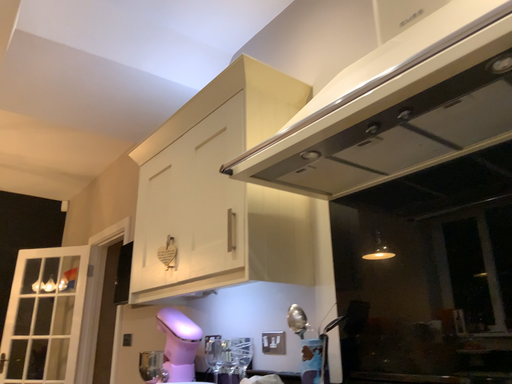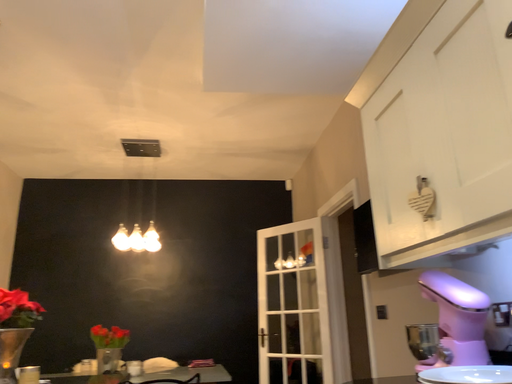
Question: Which way did the camera rotate in the video?

Choices:
 (A) rotated upward
 (B) rotated downward

Answer: (B)